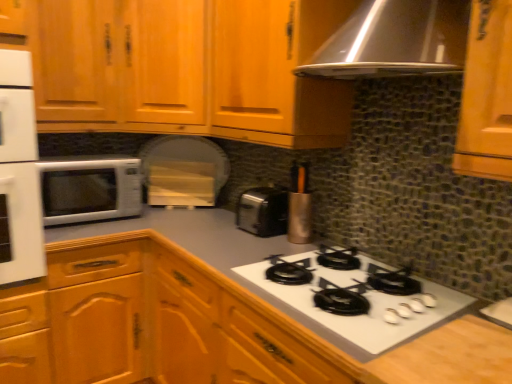
Question: Could wooden cabinet at upper left, which is counted as the first cabinetry, starting from the top, be considered to be inside white glossy sink at lower right?

Choices:
 (A) yes
 (B) no

Answer: (B)

Question: Can you confirm if white glossy sink at lower right is positioned to the right of wooden cabinet at upper left, which is counted as the first cabinetry, starting from the top?

Choices:
 (A) yes
 (B) no

Answer: (A)

Question: Is white glossy sink at lower right facing towards wooden cabinet at upper left, which is counted as the first cabinetry, starting from the top?

Choices:
 (A) no
 (B) yes

Answer: (A)

Question: Is white glossy sink at lower right closer to camera compared to wooden cabinet at upper left, which is counted as the first cabinetry, starting from the top?

Choices:
 (A) no
 (B) yes

Answer: (B)

Question: Is white glossy sink at lower right to the left of wooden cabinet at upper left, which is counted as the first cabinetry, starting from the top, from the viewer's perspective?

Choices:
 (A) yes
 (B) no

Answer: (B)

Question: Considering their positions, is metallic silver utensil holder at upper center located in front of or behind white glossy microwave at left?

Choices:
 (A) behind
 (B) front

Answer: (B)

Question: Is metallic silver utensil holder at upper center inside or outside of white glossy microwave at left?

Choices:
 (A) outside
 (B) inside

Answer: (A)

Question: Considering the relative positions of metallic silver utensil holder at upper center and white glossy microwave at left in the image provided, is metallic silver utensil holder at upper center to the left or to the right of white glossy microwave at left?

Choices:
 (A) right
 (B) left

Answer: (A)

Question: From a real-world perspective, relative to white glossy microwave at left, is metallic silver utensil holder at upper center vertically above or below?

Choices:
 (A) below
 (B) above

Answer: (B)

Question: In the image, is wooden cabinet at center, the 2th cabinetry in the top-to-bottom sequence, positioned in front of or behind metallic silver utensil holder at upper center?

Choices:
 (A) front
 (B) behind

Answer: (A)

Question: From the image's perspective, is wooden cabinet at center, the first cabinetry ordered from the bottom, above or below metallic silver utensil holder at upper center?

Choices:
 (A) below
 (B) above

Answer: (A)

Question: In terms of size, does wooden cabinet at center, the first cabinetry ordered from the bottom, appear bigger or smaller than metallic silver utensil holder at upper center?

Choices:
 (A) small
 (B) big

Answer: (B)

Question: Would you say wooden cabinet at center, the 2th cabinetry in the top-to-bottom sequence, is to the left or to the right of metallic silver utensil holder at upper center in the picture?

Choices:
 (A) left
 (B) right

Answer: (A)

Question: Is metallic silver utensil holder at upper center in front of or behind satin silver toaster at center in the image?

Choices:
 (A) front
 (B) behind

Answer: (A)

Question: In terms of size, does metallic silver utensil holder at upper center appear bigger or smaller than satin silver toaster at center?

Choices:
 (A) big
 (B) small

Answer: (B)